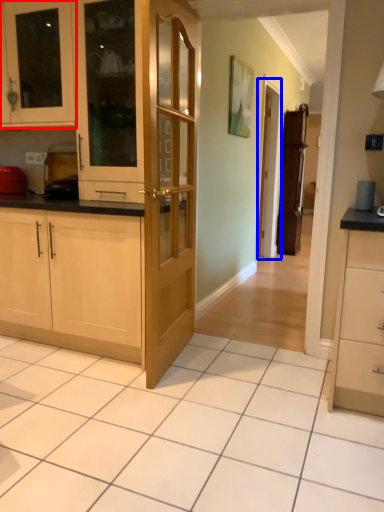
Question: Among these objects, which one is farthest to the camera, cabinetry (highlighted by a red box) or screen door (highlighted by a blue box)?

Choices:
 (A) cabinetry
 (B) screen door

Answer: (B)